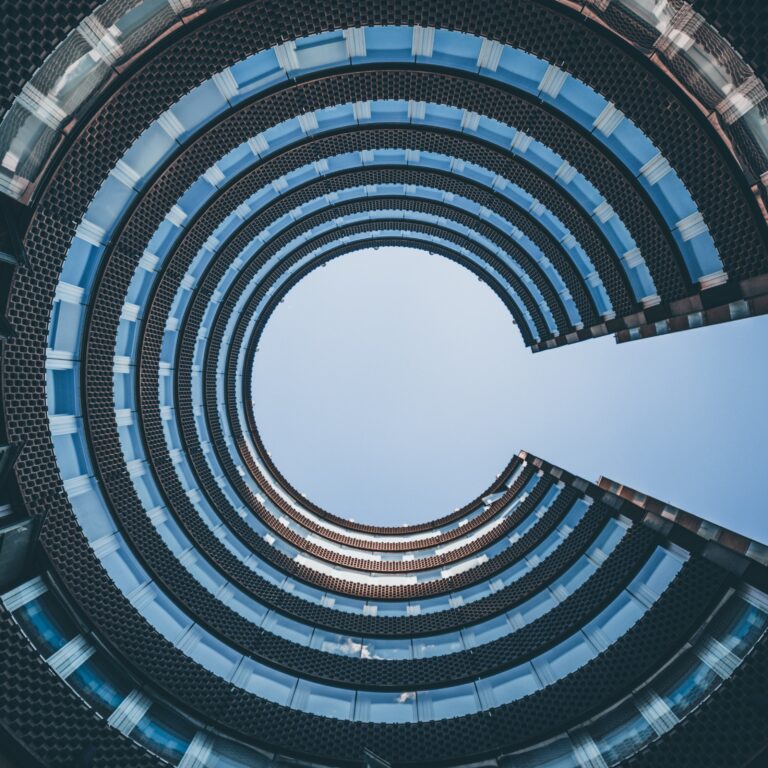
The image size is (768, 768). In order to click on open windows in this screenshot , I will do `click(12, 551)`, `click(10, 490)`, `click(4, 224)`, `click(375, 756)`.